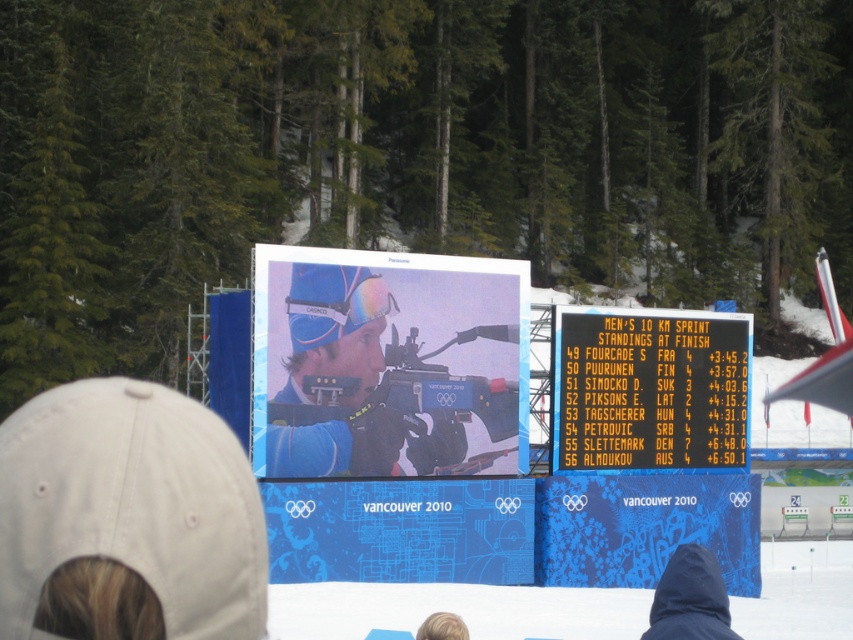
Where is `white fabric baseball cap at lower left`? white fabric baseball cap at lower left is located at coordinates tap(126, 516).

Is point (10, 634) in front of point (590, 312)?

That is True.

Between point (263, 552) and point (697, 356), which one is positioned behind?

Point (697, 356)

Locate an element on the screen. white fabric baseball cap at lower left is located at coordinates (126, 516).

Does blue matte rifle at center have a smaller size compared to black plastic scoreboard at center?

Actually, blue matte rifle at center might be larger than black plastic scoreboard at center.

Between point (421, 321) and point (663, 342), which one is positioned behind?

The point (663, 342) is behind.

In order to click on blue matte rifle at center in this screenshot , I will do `click(386, 364)`.

Between white fabric baseball cap at lower left and blue matte rifle at center, which one has more height?

Standing taller between the two is blue matte rifle at center.

Does point (48, 390) come closer to viewer compared to point (257, 426)?

No, (48, 390) is behind (257, 426).

The image size is (853, 640). I want to click on white fabric baseball cap at lower left, so click(x=126, y=516).